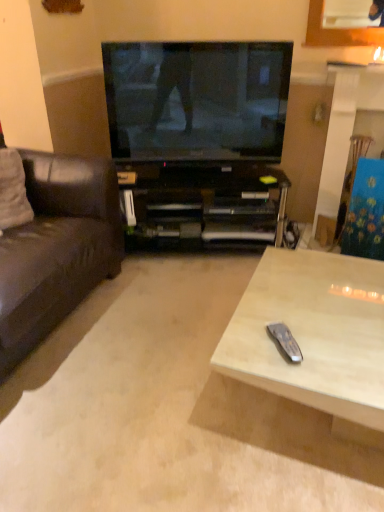
What do you see at coordinates (285, 341) in the screenshot? Image resolution: width=384 pixels, height=512 pixels. I see `silver metallic remote at lower right` at bounding box center [285, 341].

What do you see at coordinates (314, 337) in the screenshot? I see `light wood/texture remote control at lower right` at bounding box center [314, 337].

This screenshot has height=512, width=384. What do you see at coordinates (56, 248) in the screenshot? I see `brown leather couch at left` at bounding box center [56, 248].

Find the location of `white fabric pillow at left`. white fabric pillow at left is located at coordinates (13, 191).

Locate an element on the screen. The image size is (384, 512). matte black tv at center is located at coordinates (197, 99).

Can you confirm if wooden coffee table at center is positioned to the left of light wood/texture remote control at lower right?

Yes, wooden coffee table at center is to the left of light wood/texture remote control at lower right.

Is the surface of wooden coffee table at center in direct contact with light wood/texture remote control at lower right?

wooden coffee table at center is not next to light wood/texture remote control at lower right, and they're not touching.

What's the angular difference between wooden coffee table at center and light wood/texture remote control at lower right's facing directions?

There is a 89.7-degree angle between the facing directions of wooden coffee table at center and light wood/texture remote control at lower right.

From the picture: Considering the sizes of objects wooden coffee table at center and silver metallic remote at lower right in the image provided, who is shorter, wooden coffee table at center or silver metallic remote at lower right?

wooden coffee table at center is shorter.

From the image's perspective, is wooden coffee table at center positioned above or below silver metallic remote at lower right?

From the image's perspective, wooden coffee table at center appears below silver metallic remote at lower right.

Considering the relative positions of wooden coffee table at center and silver metallic remote at lower right in the image provided, is wooden coffee table at center to the left or to the right of silver metallic remote at lower right?

Result: In the image, wooden coffee table at center appears on the left side of silver metallic remote at lower right.

Who is more distant, wooden coffee table at center or silver metallic remote at lower right?

silver metallic remote at lower right is further away from the camera.

This screenshot has width=384, height=512. Identify the location of pillow that appears in front of the matte black tv at center. (13, 191).

Considering the relative sizes of matte black tv at center and white fabric pillow at left in the image provided, is matte black tv at center thinner than white fabric pillow at left?

Correct, the width of matte black tv at center is less than that of white fabric pillow at left.

From a real-world perspective, is matte black tv at center positioned under white fabric pillow at left based on gravity?

No.

Measure the distance from matte black tv at center to white fabric pillow at left.

The distance of matte black tv at center from white fabric pillow at left is 36.93 inches.

Is wooden coffee table at center completely or partially inside brown leather couch at left?

No, wooden coffee table at center is not surrounded by brown leather couch at left.

Does point (66, 226) come closer to viewer compared to point (103, 402)?

No, (66, 226) is further to viewer.

From a real-world perspective, is brown leather couch at left above or below wooden coffee table at center?

Clearly, from a real-world perspective, brown leather couch at left is above wooden coffee table at center.

Which of these two, brown leather couch at left or wooden coffee table at center, stands shorter?

With less height is wooden coffee table at center.

Looking at the image, does matte black tv at center seem bigger or smaller compared to wooden coffee table at center?

In the image, matte black tv at center appears to be larger than wooden coffee table at center.

From the image's perspective, which is below, matte black tv at center or wooden coffee table at center?

From the image's view, wooden coffee table at center is below.

You are a GUI agent. You are given a task and a screenshot of the screen. Output one action in this format:
    pyautogui.click(x=<x>, y=<y>)
    Task: Click on the television that is above the wooden coffee table at center (from the image's perspective)
    This screenshot has width=384, height=512.
    Given the screenshot: What is the action you would take?
    pyautogui.click(x=197, y=99)

Would you say white fabric pillow at left is outside light wood/texture remote control at lower right?

Yes.

Is white fabric pillow at left beside light wood/texture remote control at lower right?

There is a gap between white fabric pillow at left and light wood/texture remote control at lower right.

Which of these two, white fabric pillow at left or light wood/texture remote control at lower right, is bigger?

With larger size is light wood/texture remote control at lower right.

Can you confirm if white fabric pillow at left is positioned to the left of light wood/texture remote control at lower right?

Indeed, white fabric pillow at left is positioned on the left side of light wood/texture remote control at lower right.

Considering the relative sizes of brown leather couch at left and white fabric pillow at left in the image provided, is brown leather couch at left shorter than white fabric pillow at left?

No, brown leather couch at left is not shorter than white fabric pillow at left.

From the image's perspective, which is below, brown leather couch at left or white fabric pillow at left?

brown leather couch at left is shown below in the image.

Identify the location of pillow lying on the right of brown leather couch at left. The image size is (384, 512). (13, 191).

How much distance is there between brown leather couch at left and white fabric pillow at left?

30.73 centimeters.

Find the location of a particular element. The height and width of the screenshot is (512, 384). plain directly beneath the light wood/texture remote control at lower right (from a real-world perspective) is located at coordinates (166, 410).

Image resolution: width=384 pixels, height=512 pixels. I want to click on plain lying on the left of silver metallic remote at lower right, so click(x=166, y=410).

In the scene shown: Looking at the image, which one is located further to brown leather couch at left, light wood/texture remote control at lower right or silver metallic remote at lower right?

Based on the image, silver metallic remote at lower right appears to be further to brown leather couch at left.

Based on their spatial positions, is wooden coffee table at center or light wood/texture remote control at lower right further from matte black tv at center?

The object further to matte black tv at center is wooden coffee table at center.

Estimate the real-world distances between objects in this image. Which object is further from matte black tv at center, brown leather couch at left or silver metallic remote at lower right?

silver metallic remote at lower right lies further to matte black tv at center than the other object.

From the picture: From the image, which object appears to be farther from wooden coffee table at center, brown leather couch at left or silver metallic remote at lower right?

silver metallic remote at lower right is further to wooden coffee table at center.

Which object lies further to the anchor point brown leather couch at left, matte black tv at center or black plastic cabinet at center?

Among the two, matte black tv at center is located further to brown leather couch at left.

Considering their positions, is black plastic cabinet at center positioned closer to matte black tv at center than brown leather couch at left?

black plastic cabinet at center is closer to matte black tv at center.

Looking at the image, which one is located closer to light wood/texture remote control at lower right, matte black tv at center or white fabric pillow at left?

matte black tv at center is closer to light wood/texture remote control at lower right.

Based on their spatial positions, is wooden coffee table at center or light wood/texture remote control at lower right further from brown leather couch at left?

light wood/texture remote control at lower right is further to brown leather couch at left.

You are a GUI agent. You are given a task and a screenshot of the screen. Output one action in this format:
    pyautogui.click(x=<x>, y=<y>)
    Task: Click on the television located between brown leather couch at left and silver metallic remote at lower right in the left-right direction
    The height and width of the screenshot is (512, 384).
    Given the screenshot: What is the action you would take?
    pyautogui.click(x=197, y=99)

Find the location of a particular element. The width and height of the screenshot is (384, 512). television situated between white fabric pillow at left and light wood/texture remote control at lower right from left to right is located at coordinates (197, 99).

The width and height of the screenshot is (384, 512). Identify the location of remote control between matte black tv at center and wooden coffee table at center in the vertical direction. (285, 341).

This screenshot has width=384, height=512. I want to click on television between brown leather couch at left and black plastic cabinet at center along the z-axis, so pyautogui.click(x=197, y=99).